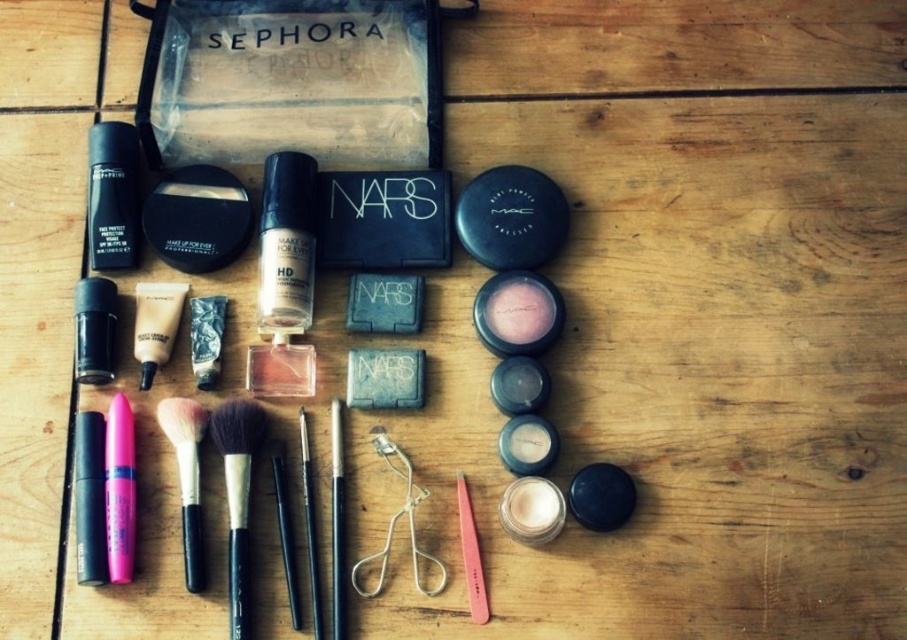
What is located at the point with coordinates (519, 310) in the image?

The point at coordinates (519, 310) corresponds to the matte pink powder at center right.

You are organizing a makeup kit and need to place the matte black foundation at left. Where exactly should you position it on the wooden surface?

The matte black foundation at left should be positioned at point (112, 196) on the wooden surface according to the coordinates provided.

You are standing 4 feet away from the wooden table. If you want to reach the point at coordinates point (242,625), will you be able to reach it without moving closer?

The distance of point (242,625) from viewer is 3.80 feet. Since you are standing 4 feet away, you are 0.2 feet farther than needed. You need to move 0.2 feet closer to reach it.